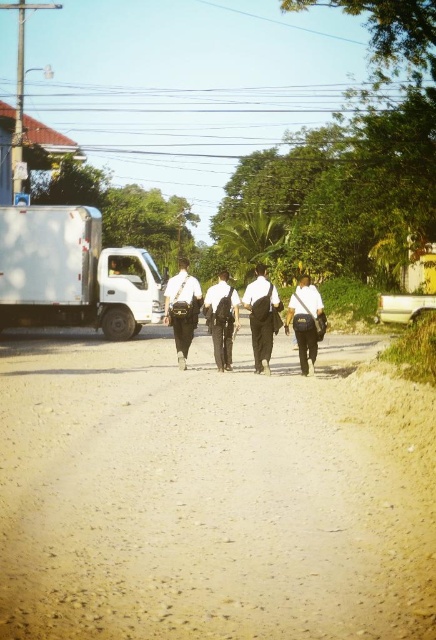
Is point (336, 381) closer to camera compared to point (312, 292)?

That is True.

Who is more distant from viewer, (210,586) or (314,310)?

The point (314,310) is behind.

I want to click on brown gravel road at center, so click(211, 493).

Is black leather bag at center positioned behind black leather pants at center?

No, it is not.

Consider the image. Is black leather bag at center positioned before black leather pants at center?

Yes, it is.

Where is `black leather bag at center`? This screenshot has height=640, width=436. black leather bag at center is located at coordinates (181, 308).

Is matte black bag at center above black leather pants at center?

No.

Who is positioned more to the left, matte black bag at center or black leather pants at center?

From the viewer's perspective, black leather pants at center appears more on the left side.

Where is `matte black bag at center`? The width and height of the screenshot is (436, 640). matte black bag at center is located at coordinates (305, 321).